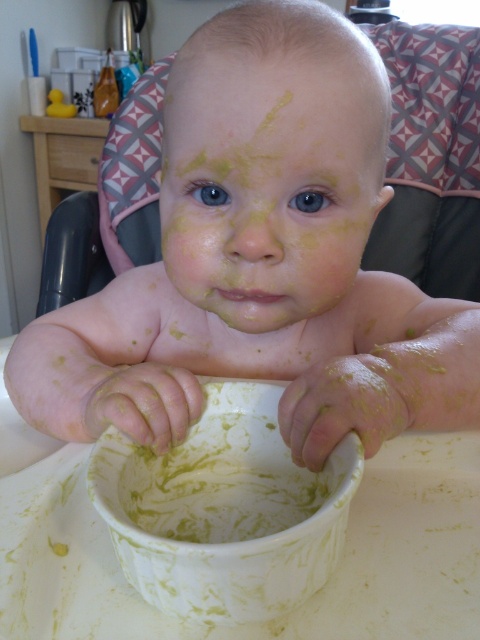
Question: Is yellow matte face at center closer to the viewer compared to white matte bowl at center?

Choices:
 (A) no
 (B) yes

Answer: (A)

Question: Among these points, which one is farthest from the camera?

Choices:
 (A) (129, 289)
 (B) (192, 513)

Answer: (A)

Question: Which object is closer to the camera taking this photo?

Choices:
 (A) white matte bowl at center
 (B) yellow matte face at center
 (C) yellow matte baby at center
 (D) yellow matte bowl at center

Answer: (A)

Question: Estimate the real-world distances between objects in this image. Which object is closer to the white matte bowl at center?

Choices:
 (A) yellow matte face at center
 (B) yellow matte bowl at center
 (C) yellow matte baby at center

Answer: (B)

Question: Does yellow matte baby at center have a smaller size compared to white matte bowl at center?

Choices:
 (A) no
 (B) yes

Answer: (A)

Question: In this image, where is yellow matte baby at center located relative to yellow matte bowl at center?

Choices:
 (A) below
 (B) above

Answer: (B)